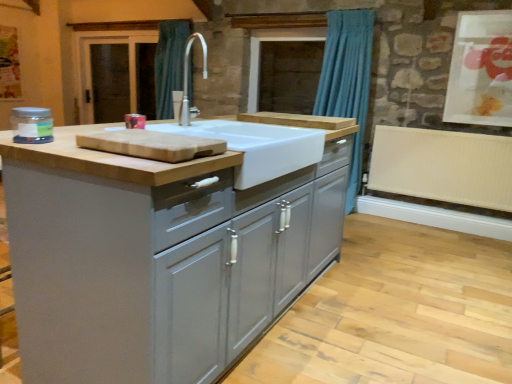
Where is `free spot below matte paper artwork at upper right (from a real-world perspective)`? This screenshot has width=512, height=384. free spot below matte paper artwork at upper right (from a real-world perspective) is located at coordinates (472, 133).